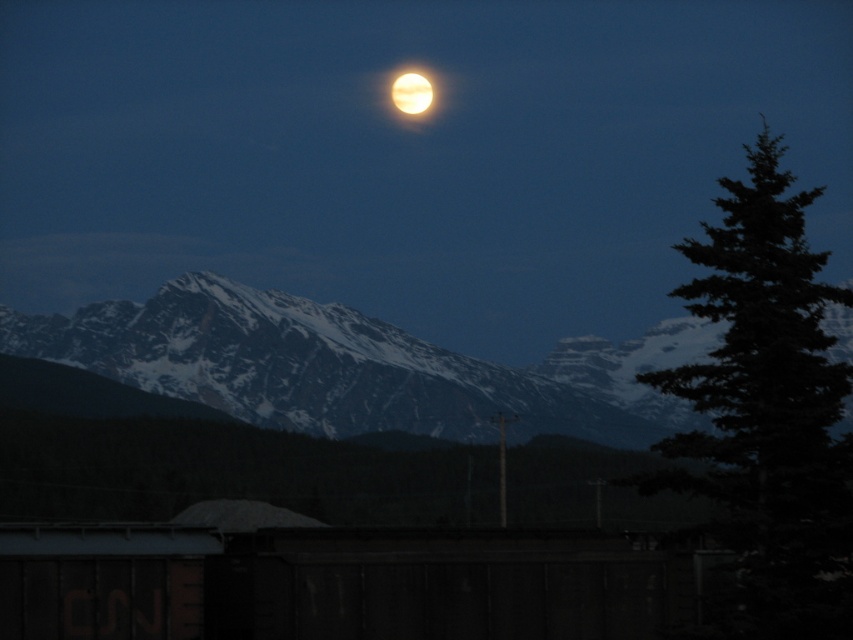
Can you confirm if green textured tree at right is wider than bright yellowish-white moon at upper center?

Yes.

Is green textured tree at right below bright yellowish-white moon at upper center?

Yes.

Is point (849, 369) farther from viewer compared to point (393, 76)?

No.

Find the location of a particular element. green textured tree at right is located at coordinates (766, 412).

Who is lower down, bright yellowish-white moon at upper center or bright yellow moon at upper center?

bright yellow moon at upper center is below.

Can you confirm if bright yellowish-white moon at upper center is bigger than bright yellow moon at upper center?

Yes, bright yellowish-white moon at upper center is bigger than bright yellow moon at upper center.

Where is `bright yellowish-white moon at upper center`? The image size is (853, 640). bright yellowish-white moon at upper center is located at coordinates click(413, 93).

Between point (363, 394) and point (811, 616), which one is positioned in front?

Point (811, 616) is in front.

Is snowy rock mountain range at center to the left of green textured tree at right from the viewer's perspective?

Yes, snowy rock mountain range at center is to the left of green textured tree at right.

Is point (614, 378) positioned after point (763, 186)?

Yes, point (614, 378) is behind point (763, 186).

Locate an element on the screen. The image size is (853, 640). snowy rock mountain range at center is located at coordinates (358, 365).